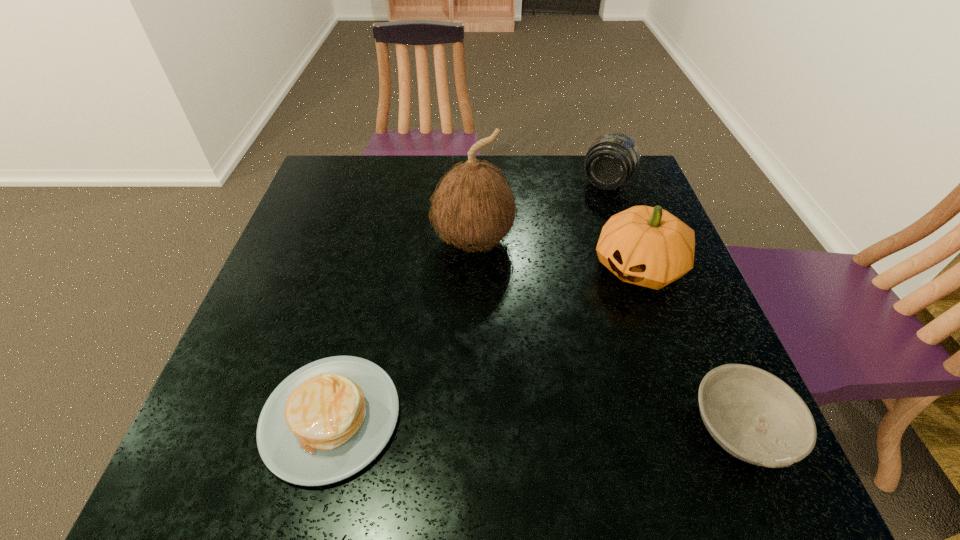
Find the location of a particular element. This screenshot has width=960, height=540. vacant space on the desktop that is between the pancake and the bowl and is positioned on the surface of the tallest object is located at coordinates (478, 420).

Where is `vacant space on the desktop that is between the leftmost object and the bowl and is positioned at the front element of the farthest object`? This screenshot has height=540, width=960. vacant space on the desktop that is between the leftmost object and the bowl and is positioned at the front element of the farthest object is located at coordinates (475, 420).

Identify the location of vacant space on the desktop that is between the leftmost object and the bowl and is positioned on the side of the fourth shortest object with the carved face. (512, 421).